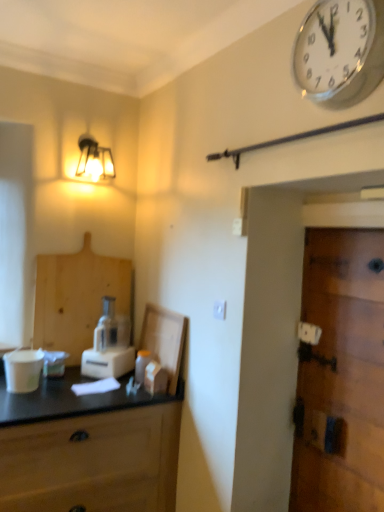
Question: Are wooden door at right and matte glass lamp at upper left located far from each other?

Choices:
 (A) yes
 (B) no

Answer: (A)

Question: From the image's perspective, is wooden door at right on matte glass lamp at upper left?

Choices:
 (A) yes
 (B) no

Answer: (B)

Question: Is wooden door at right facing away from matte glass lamp at upper left?

Choices:
 (A) no
 (B) yes

Answer: (A)

Question: From a real-world perspective, is wooden door at right positioned under matte glass lamp at upper left based on gravity?

Choices:
 (A) yes
 (B) no

Answer: (A)

Question: Does wooden door at right have a greater height compared to matte glass lamp at upper left?

Choices:
 (A) yes
 (B) no

Answer: (A)

Question: Considering the positions of white plastic electric outlet at center and matte glass lamp at upper left in the image, is white plastic electric outlet at center wider or thinner than matte glass lamp at upper left?

Choices:
 (A) wide
 (B) thin

Answer: (B)

Question: From a real-world perspective, relative to matte glass lamp at upper left, is white plastic electric outlet at center vertically above or below?

Choices:
 (A) above
 (B) below

Answer: (B)

Question: Based on their positions, is white plastic electric outlet at center located to the left or right of matte glass lamp at upper left?

Choices:
 (A) left
 (B) right

Answer: (B)

Question: Is point (213, 306) closer or farther from the camera than point (105, 173)?

Choices:
 (A) farther
 (B) closer

Answer: (B)

Question: Is matte glass lamp at upper left taller or shorter than wooden door at right?

Choices:
 (A) tall
 (B) short

Answer: (B)

Question: In the image, is matte glass lamp at upper left positioned in front of or behind wooden door at right?

Choices:
 (A) front
 (B) behind

Answer: (B)

Question: Considering the positions of matte glass lamp at upper left and wooden door at right in the image, is matte glass lamp at upper left wider or thinner than wooden door at right?

Choices:
 (A) wide
 (B) thin

Answer: (A)

Question: Would you say matte glass lamp at upper left is inside or outside wooden door at right?

Choices:
 (A) outside
 (B) inside

Answer: (A)

Question: Choose the correct answer: Is white glossy wall clock at upper right inside white plastic blender at center or outside it?

Choices:
 (A) inside
 (B) outside

Answer: (B)

Question: Visually, is white glossy wall clock at upper right positioned to the left or to the right of white plastic blender at center?

Choices:
 (A) right
 (B) left

Answer: (A)